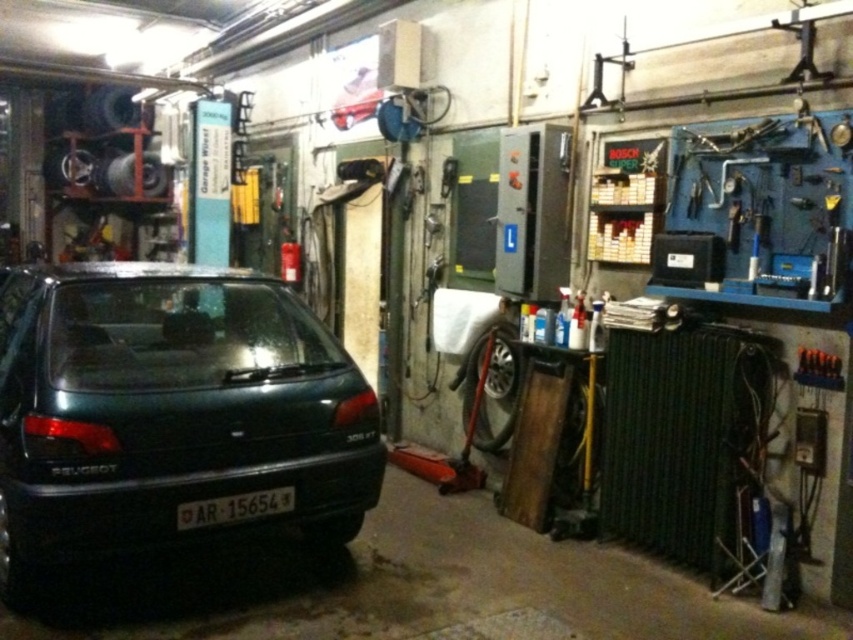
You are a mechanic working in this garage. You need to move a heavy tool from the Bosch Super tool box above the pegboard to the green matte car at left. Based on the coordinates provided, in which direction should you move the tool relative to the Bosch Super tool box above the pegboard?

The green matte car at left is located at coordinates point (167, 412). Since the Bosch Super tool box is above the pegboard, you should move the tool downward and to the right to reach the green matte car at left.

You are standing at the entrance of the garage and want to move towards the point labeled as point (158, 433). Is this point closer to you than the other point labeled point (202, 509)?

Yes, point (158, 433) is in front of point (202, 509), so it is closer to you.